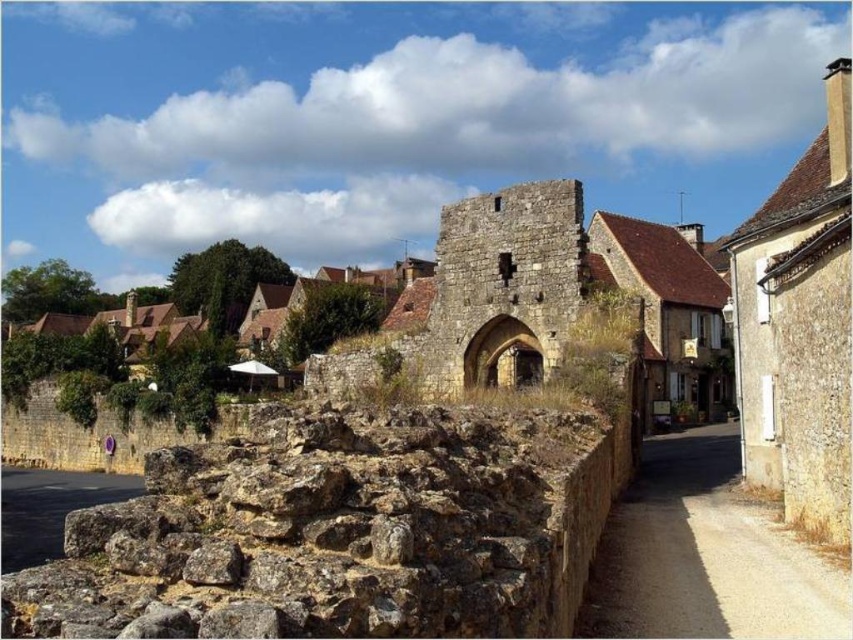
Question: Does brown stone alley at lower right have a lesser width compared to dark gray stone alley at lower left?

Choices:
 (A) yes
 (B) no

Answer: (A)

Question: Which object appears farthest from the camera in this image?

Choices:
 (A) brown rough stone wall at lower left
 (B) brown stone alley at lower right

Answer: (B)

Question: Which point appears farthest from the camera in this image?

Choices:
 (A) (755, 541)
 (B) (300, 449)
 (C) (28, 536)

Answer: (C)

Question: Does brown stone alley at lower right have a smaller size compared to dark gray stone alley at lower left?

Choices:
 (A) no
 (B) yes

Answer: (B)

Question: Which of the following is the closest to the observer?

Choices:
 (A) (631, 636)
 (B) (88, 472)

Answer: (A)

Question: Can you confirm if brown stone alley at lower right is bigger than dark gray stone alley at lower left?

Choices:
 (A) no
 (B) yes

Answer: (A)